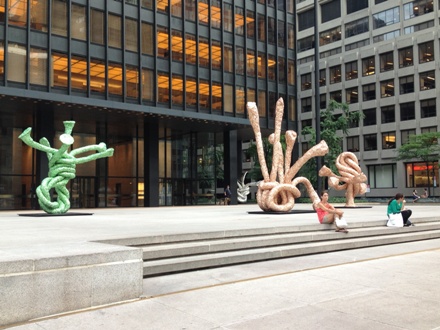
You are a GUI agent. You are given a task and a screenshot of the screen. Output one action in this format:
    pyautogui.click(x=<x>, y=<y>)
    Task: Click on the blinds
    The width and height of the screenshot is (440, 330).
    Given the screenshot: What is the action you would take?
    click(x=383, y=176)